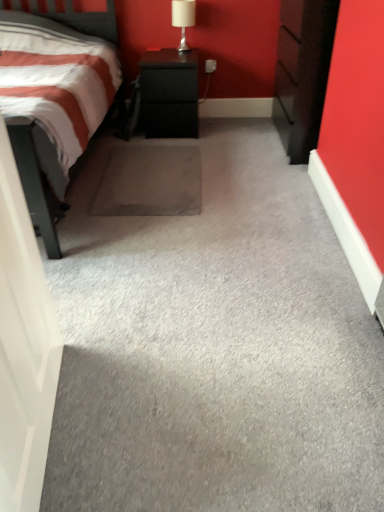
Question: Is gray carpet at center in front of white glossy door at left?

Choices:
 (A) yes
 (B) no

Answer: (B)

Question: Is white glossy door at left a part of gray carpet at center?

Choices:
 (A) no
 (B) yes

Answer: (A)

Question: Are gray carpet at center and white glossy door at left far apart?

Choices:
 (A) no
 (B) yes

Answer: (A)

Question: Is the position of gray carpet at center more distant than that of white glossy door at left?

Choices:
 (A) no
 (B) yes

Answer: (B)

Question: Does gray carpet at center have a lesser height compared to white glossy door at left?

Choices:
 (A) no
 (B) yes

Answer: (B)

Question: Is gray carpet at center completely or partially outside of white glossy door at left?

Choices:
 (A) yes
 (B) no

Answer: (A)

Question: Is white glossy table lamp at upper center not within black textured cabinet at center?

Choices:
 (A) no
 (B) yes

Answer: (B)

Question: Is white glossy table lamp at upper center taller than black textured cabinet at center?

Choices:
 (A) yes
 (B) no

Answer: (B)

Question: From a real-world perspective, does white glossy table lamp at upper center stand above black textured cabinet at center?

Choices:
 (A) no
 (B) yes

Answer: (B)

Question: Is white glossy table lamp at upper center wider than black textured cabinet at center?

Choices:
 (A) yes
 (B) no

Answer: (B)

Question: Is white glossy table lamp at upper center positioned in front of black textured cabinet at center?

Choices:
 (A) no
 (B) yes

Answer: (A)

Question: Is white glossy table lamp at upper center thinner than black textured cabinet at center?

Choices:
 (A) yes
 (B) no

Answer: (A)

Question: Considering the relative sizes of gray carpet at center and white glossy table lamp at upper center in the image provided, is gray carpet at center bigger than white glossy table lamp at upper center?

Choices:
 (A) yes
 (B) no

Answer: (A)